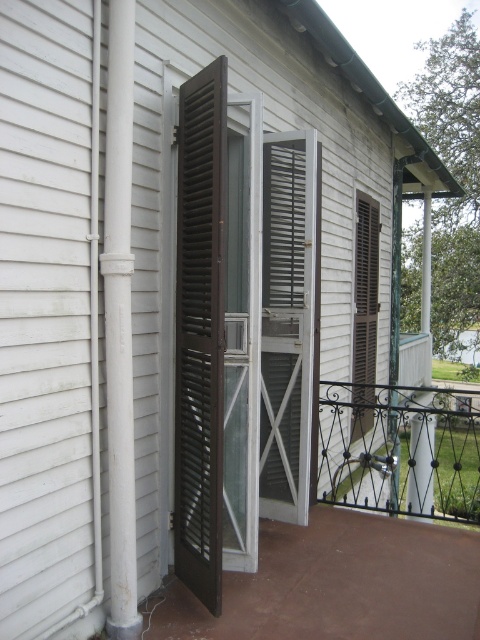
You are a painter assessing the exterior of a house. You need to paint both the brown wooden screen door at left and the white painted metal pipe at left. Since you want to ensure you have enough paint, which object requires more paint in terms of surface area?

The white painted metal pipe at left requires more paint because it has a greater height than the brown wooden screen door at left, leading to a larger surface area.

You are standing in front of the house and looking at the balcony. There are two points marked on the balcony railing. Which point, point (192, 323) or point (132, 83), is closer to you?

Point (192, 323) is closer to you because it is further to the viewer than point (132, 83).

You are standing in front of the house shown in the image. You notice a point at coordinates (200, 332). What object does this point correspond to?

The point at coordinates (200, 332) corresponds to the brown wooden screen door at left.